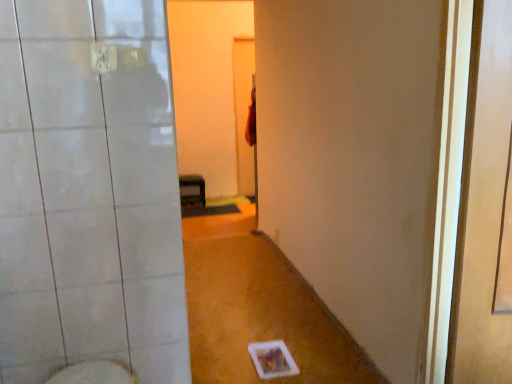
This screenshot has height=384, width=512. What do you see at coordinates (483, 205) in the screenshot?
I see `transparent plastic screen door at right` at bounding box center [483, 205].

Measure the distance between point (483, 237) and camera.

The depth of point (483, 237) is 1.61 meters.

What is the approximate height of matte black shelf at center?

matte black shelf at center is 14.65 inches tall.

Where is `transparent plastic screen door at right`? Image resolution: width=512 pixels, height=384 pixels. transparent plastic screen door at right is located at coordinates tap(483, 205).

Is transparent plastic screen door at right turned away from matte black shelf at center?

transparent plastic screen door at right is not turned away from matte black shelf at center.

How different are the orientations of transparent plastic screen door at right and matte black shelf at center in degrees?

92.1 degrees.

Considering the relative sizes of transparent plastic screen door at right and matte black shelf at center in the image provided, is transparent plastic screen door at right smaller than matte black shelf at center?

No, transparent plastic screen door at right is not smaller than matte black shelf at center.

Can matte black shelf at center be found inside transparent plastic screen door at right?

Definitely not — matte black shelf at center is not inside transparent plastic screen door at right.

Considering the positions of points (132, 378) and (184, 188), is point (132, 378) farther from camera compared to point (184, 188)?

No, (132, 378) is in front of (184, 188).

Considering the relative positions of white glossy bidet at lower left and matte black shelf at center in the image provided, is white glossy bidet at lower left to the right of matte black shelf at center from the viewer's perspective?

Indeed, white glossy bidet at lower left is positioned on the right side of matte black shelf at center.

Does white glossy bidet at lower left have a greater width compared to matte black shelf at center?

No.

What's the angular difference between white glossy bidet at lower left and matte black shelf at center's facing directions?

The facing directions of white glossy bidet at lower left and matte black shelf at center are 2.63 degrees apart.

Can you confirm if matte black shelf at center is taller than white glossy bidet at lower left?

Correct, matte black shelf at center is much taller as white glossy bidet at lower left.

Can we say matte black shelf at center lies outside white glossy bidet at lower left?

Indeed, matte black shelf at center is completely outside white glossy bidet at lower left.

Considering the positions of point (190, 188) and point (120, 379), is point (190, 188) closer or farther from the camera than point (120, 379)?

Point (190, 188).

This screenshot has height=384, width=512. Identify the location of furniture located underneath the white glossy bidet at lower left (from a real-world perspective). (192, 190).

Find the location of a particular element. The height and width of the screenshot is (384, 512). bidet behind the transparent plastic screen door at right is located at coordinates (93, 374).

Is transparent plastic screen door at right smaller than white glossy bidet at lower left?

No, transparent plastic screen door at right is not smaller than white glossy bidet at lower left.

From the picture: Is white glossy bidet at lower left a part of transparent plastic screen door at right?

That's incorrect, white glossy bidet at lower left is not inside transparent plastic screen door at right.

Between transparent plastic screen door at right and white glossy bidet at lower left, which one has smaller width?

With smaller width is transparent plastic screen door at right.

Is matte black shelf at center not near transparent plastic screen door at right?

Yes, matte black shelf at center and transparent plastic screen door at right are located far from each other.

Does matte black shelf at center lie behind transparent plastic screen door at right?

Yes.

In the scene shown: How different are the orientations of matte black shelf at center and transparent plastic screen door at right in degrees?

They differ by 92.1 degrees in their facing directions.

Can you confirm if white glossy bidet at lower left is taller than transparent plastic screen door at right?

No, white glossy bidet at lower left is not taller than transparent plastic screen door at right.

In terms of size, does white glossy bidet at lower left appear bigger or smaller than transparent plastic screen door at right?

Considering their sizes, white glossy bidet at lower left takes up less space than transparent plastic screen door at right.

Is transparent plastic screen door at right surrounded by white glossy bidet at lower left?

No, transparent plastic screen door at right is located outside of white glossy bidet at lower left.

Which of these two, white glossy bidet at lower left or transparent plastic screen door at right, is thinner?

Thinner between the two is transparent plastic screen door at right.

This screenshot has height=384, width=512. There is a matte black shelf at center. What are the coordinates of `screen door above it (from a real-world perspective)` in the screenshot? It's located at (483, 205).

Locate an element on the screen. This screenshot has width=512, height=384. furniture below the white glossy bidet at lower left (from a real-world perspective) is located at coordinates (192, 190).

Looking at the image, which one is located further to matte black shelf at center, transparent plastic screen door at right or white glossy bidet at lower left?

Based on the image, transparent plastic screen door at right appears to be further to matte black shelf at center.

Based on the photo, considering their positions, is white glossy bidet at lower left positioned closer to transparent plastic screen door at right than matte black shelf at center?

Among the two, white glossy bidet at lower left is located nearer to transparent plastic screen door at right.

Estimate the real-world distances between objects in this image. Which object is closer to white glossy bidet at lower left, matte black shelf at center or transparent plastic screen door at right?

Based on the image, transparent plastic screen door at right appears to be nearer to white glossy bidet at lower left.

Considering their positions, is white glossy bidet at lower left positioned closer to matte black shelf at center than transparent plastic screen door at right?

white glossy bidet at lower left.

Which object lies further to the anchor point white glossy bidet at lower left, transparent plastic screen door at right or matte black shelf at center?

Based on the image, matte black shelf at center appears to be further to white glossy bidet at lower left.

Which object lies nearer to the anchor point transparent plastic screen door at right, matte black shelf at center or white glossy bidet at lower left?

white glossy bidet at lower left is closer to transparent plastic screen door at right.

Where is `bidet between transparent plastic screen door at right and matte black shelf at center from front to back`? The width and height of the screenshot is (512, 384). bidet between transparent plastic screen door at right and matte black shelf at center from front to back is located at coordinates (93, 374).